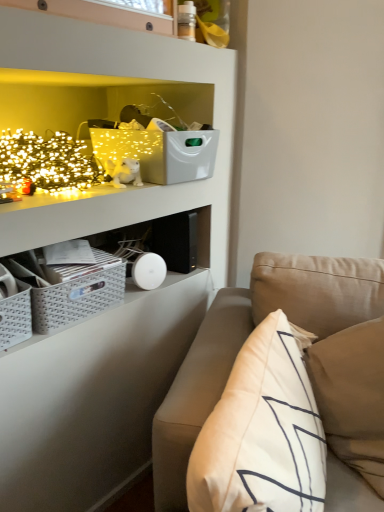
Question: From their relative heights in the image, would you say white plush cat at upper left is taller or shorter than beige fabric couch at lower right?

Choices:
 (A) tall
 (B) short

Answer: (B)

Question: From a real-world perspective, is white plush cat at upper left physically located above or below beige fabric couch at lower right?

Choices:
 (A) above
 (B) below

Answer: (A)

Question: Considering the real-world distances, which object is farthest from the white soft pillow at right?

Choices:
 (A) beige fabric couch at lower right
 (B) white plush cat at upper left
 (C) gray woven crate at lower left

Answer: (B)

Question: Which is farther from the white plush cat at upper left?

Choices:
 (A) beige fabric couch at lower right
 (B) white soft pillow at right
 (C) gray woven crate at lower left

Answer: (B)